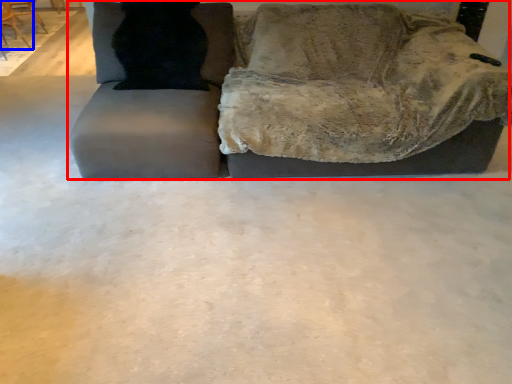
Question: Which object appears closest to the camera in this image, studio couch (highlighted by a red box) or chair (highlighted by a blue box)?

Choices:
 (A) studio couch
 (B) chair

Answer: (A)